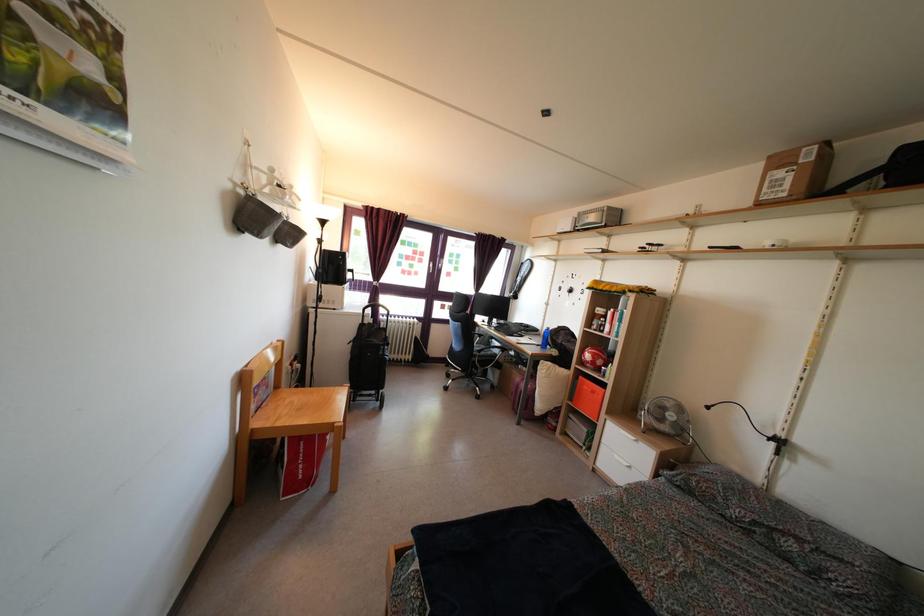
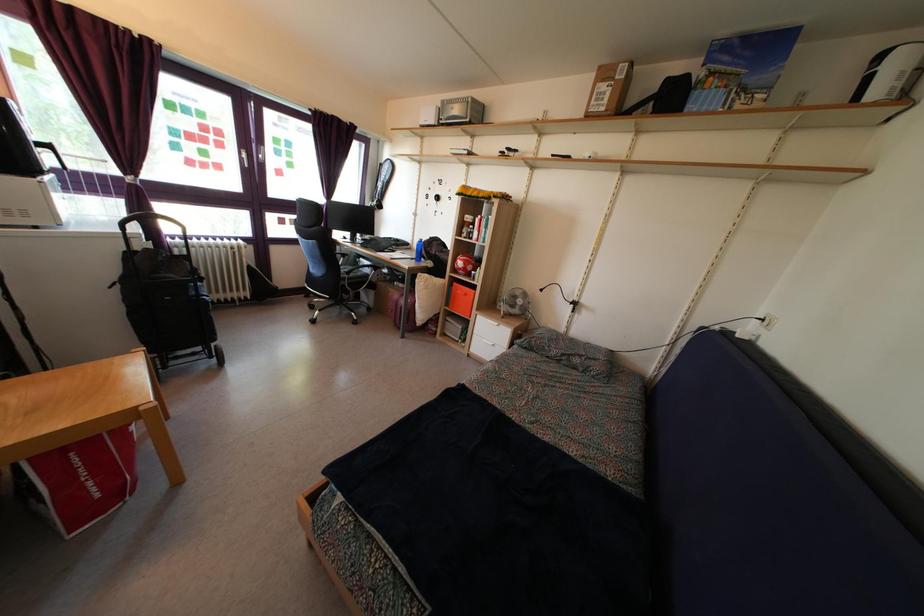
Locate, in the second image, the point that corresponds to point 482,360 in the first image.

(350, 282)